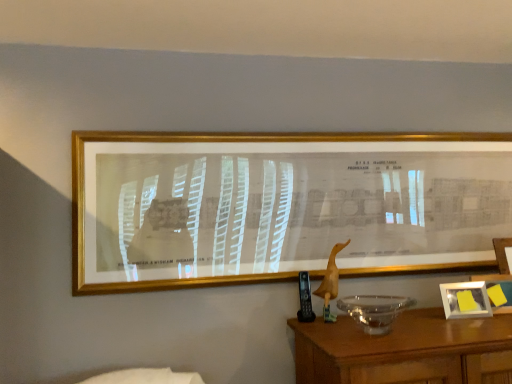
Question: Does gold metallic picture frame at upper center, the first picture frame positioned from the top, touch white plastic picture frame at lower right, acting as the 2th picture frame starting from the front?

Choices:
 (A) yes
 (B) no

Answer: (B)

Question: Is gold metallic picture frame at upper center, the 1th picture frame from the front, located outside white plastic picture frame at lower right, the 1th picture frame in the bottom-to-top sequence?

Choices:
 (A) yes
 (B) no

Answer: (A)

Question: From the image's perspective, is gold metallic picture frame at upper center, the 2th picture frame from the right, above white plastic picture frame at lower right, which is the second picture frame from top to bottom?

Choices:
 (A) yes
 (B) no

Answer: (A)

Question: From a real-world perspective, does gold metallic picture frame at upper center, the 2th picture frame from the right, stand above white plastic picture frame at lower right, positioned as the 2th picture frame in left-to-right order?

Choices:
 (A) yes
 (B) no

Answer: (A)

Question: From the image's perspective, is gold metallic picture frame at upper center, the 1th picture frame from the front, under white plastic picture frame at lower right, which is the second picture frame from top to bottom?

Choices:
 (A) yes
 (B) no

Answer: (B)

Question: Visually, is gold metallic picture frame at upper center, the 1th picture frame from the front, positioned to the left or to the right of transparent glass bowl at lower right?

Choices:
 (A) left
 (B) right

Answer: (A)

Question: From the image's perspective, is gold metallic picture frame at upper center, which is the second picture frame in bottom-to-top order, located above or below transparent glass bowl at lower right?

Choices:
 (A) above
 (B) below

Answer: (A)

Question: From their relative heights in the image, would you say gold metallic picture frame at upper center, the first picture frame positioned from the top, is taller or shorter than transparent glass bowl at lower right?

Choices:
 (A) tall
 (B) short

Answer: (A)

Question: In terms of width, does gold metallic picture frame at upper center, the 2th picture frame from the right, look wider or thinner when compared to transparent glass bowl at lower right?

Choices:
 (A) thin
 (B) wide

Answer: (A)

Question: Considering the positions of gold metallic picture frame at upper center, which is the second picture frame in bottom-to-top order, and white plastic picture frame at lower right, which is the second picture frame from top to bottom, in the image, is gold metallic picture frame at upper center, which is the second picture frame in bottom-to-top order, taller or shorter than white plastic picture frame at lower right, which is the second picture frame from top to bottom,?

Choices:
 (A) tall
 (B) short

Answer: (A)

Question: Do you think gold metallic picture frame at upper center, placed as the 2th picture frame when sorted from back to front, is within white plastic picture frame at lower right, acting as the 1th picture frame starting from the back, or outside of it?

Choices:
 (A) inside
 (B) outside

Answer: (B)

Question: From the image's perspective, is gold metallic picture frame at upper center, the 2th picture frame from the right, positioned above or below white plastic picture frame at lower right, positioned as the 2th picture frame in left-to-right order?

Choices:
 (A) below
 (B) above

Answer: (B)

Question: From a real-world perspective, is gold metallic picture frame at upper center, arranged as the 1th picture frame when viewed from the left, above or below white plastic picture frame at lower right, positioned as the first picture frame in right-to-left order?

Choices:
 (A) below
 (B) above

Answer: (B)

Question: In terms of height, does transparent glass bowl at lower right look taller or shorter compared to white plastic picture frame at lower right, acting as the 2th picture frame starting from the front?

Choices:
 (A) short
 (B) tall

Answer: (B)

Question: Is point click(389, 299) closer or farther from the camera than point click(486, 309)?

Choices:
 (A) farther
 (B) closer

Answer: (A)